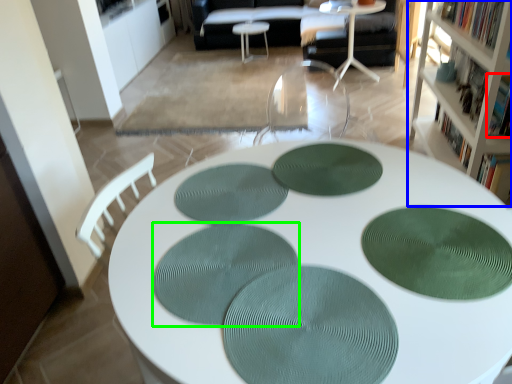
Question: Which is farther away from book (highlighted by a red box)? cabinetry (highlighted by a blue box) or mat (highlighted by a green box)?

Choices:
 (A) cabinetry
 (B) mat

Answer: (B)